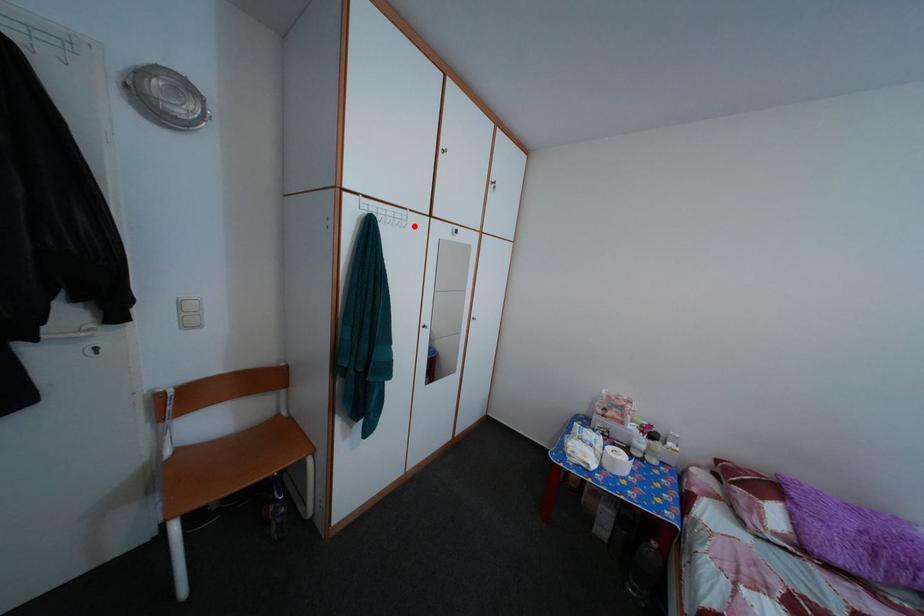
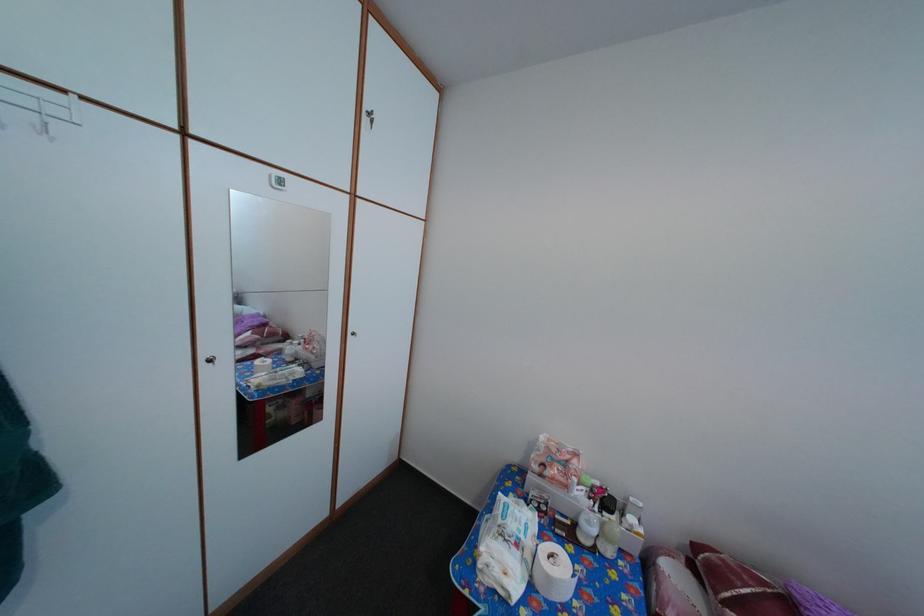
Question: I am providing you with two images of the same scene from different viewpoints. A red point is marked on the first image. Can you still see the location of the red point in image 2?

Choices:
 (A) Yes
 (B) No

Answer: (A)